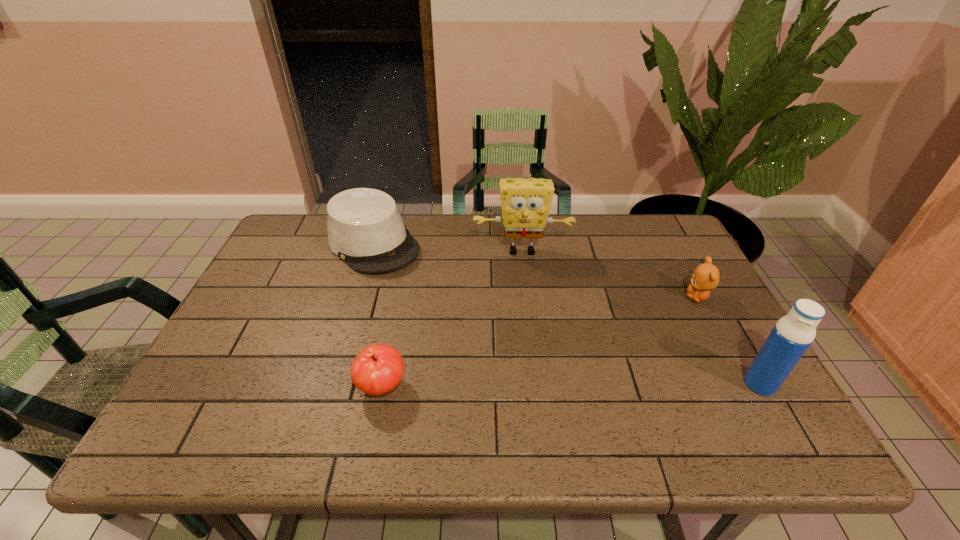
Find the location of a particular element. This screenshot has height=540, width=960. free space on the desktop that is between the apple and the water bottle and is positioned on the face of the teddy bear is located at coordinates (587, 385).

Where is `free spot on the desktop that is between the apple and the water bottle and is positioned on the face of the third object from right to left`? free spot on the desktop that is between the apple and the water bottle and is positioned on the face of the third object from right to left is located at coordinates (532, 386).

In order to click on free space on the desktop that is between the apple and the water bottle and is positioned on the front-facing side of the hat in this screenshot , I will do `click(523, 386)`.